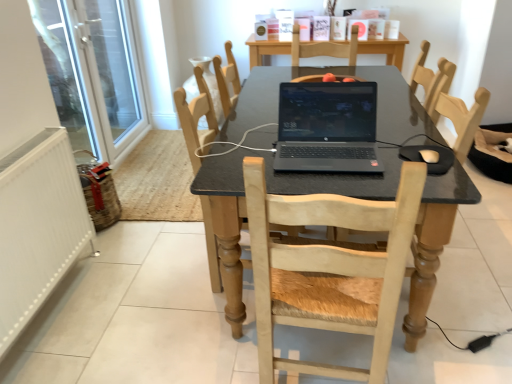
What do you see at coordinates (272, 193) in the screenshot? I see `matte black table at center` at bounding box center [272, 193].

What is the approximate height of light wood chair at center, which ranks as the 1th chair in front-to-back order?

light wood chair at center, which ranks as the 1th chair in front-to-back order, is 1.01 meters tall.

Find the location of a particular element. The image size is (512, 384). light wood chair at center, the 3th chair positioned from the back is located at coordinates (329, 269).

Where is `black matte laptop at center`? black matte laptop at center is located at coordinates (327, 127).

Where is `white textured radiator at left`? This screenshot has width=512, height=384. white textured radiator at left is located at coordinates (38, 227).

Where is `light wood chair at center, which is counted as the 2th chair, starting from the back`? The width and height of the screenshot is (512, 384). light wood chair at center, which is counted as the 2th chair, starting from the back is located at coordinates (196, 121).

This screenshot has height=384, width=512. I want to click on white matte mouse at lower right, so click(429, 155).

Describe the element at coordinates (210, 84) in the screenshot. I see `wooden chair at upper center, the 1th chair from the back` at that location.

Locate an element on the screen. The width and height of the screenshot is (512, 384). wooden chair at upper center, the 1th chair from the back is located at coordinates (210, 84).

You are a GUI agent. You are given a task and a screenshot of the screen. Output one action in this format:
    pyautogui.click(x=<x>, y=<y>)
    Task: Click on the matte black table at center
    This screenshot has height=384, width=512.
    Given the screenshot: What is the action you would take?
    pyautogui.click(x=272, y=193)

Is white matte mouse at lower right further to camera compared to matte black table at center?

That is True.

Does white matte mouse at lower right turn towards matte black table at center?

No, white matte mouse at lower right is not facing towards matte black table at center.

Considering the sizes of white matte mouse at lower right and matte black table at center in the image, is white matte mouse at lower right bigger or smaller than matte black table at center?

Clearly, white matte mouse at lower right is smaller in size than matte black table at center.

Between white matte mouse at lower right and matte black table at center, which one appears on the left side from the viewer's perspective?

From the viewer's perspective, matte black table at center appears more on the left side.

Does light wood chair at center, which ranks as the 1th chair in front-to-back order, contain white textured radiator at left?

No, white textured radiator at left is not a part of light wood chair at center, which ranks as the 1th chair in front-to-back order.

Is light wood chair at center, the 3th chair positioned from the back, to the left of white textured radiator at left from the viewer's perspective?

No.

Based on the photo, how different are the orientations of light wood chair at center, the 3th chair positioned from the back, and white textured radiator at left in degrees?

light wood chair at center, the 3th chair positioned from the back, and white textured radiator at left are facing 86.6 degrees away from each other.

Considering the relative sizes of light wood chair at center, the 3th chair positioned from the back, and white textured radiator at left in the image provided, is light wood chair at center, the 3th chair positioned from the back, wider than white textured radiator at left?

Correct, the width of light wood chair at center, the 3th chair positioned from the back, exceeds that of white textured radiator at left.

From a real-world perspective, between white matte mouse at lower right and white glass screen door at left, who is vertically lower?

white glass screen door at left is physically lower.

Based on the photo, what's the angular difference between white matte mouse at lower right and white glass screen door at left's facing directions?

The angular difference between white matte mouse at lower right and white glass screen door at left is 86.9 degrees.

Consider the image. Is white matte mouse at lower right wider or thinner than white glass screen door at left?

In the image, white matte mouse at lower right appears to be wider than white glass screen door at left.

Is white matte mouse at lower right aimed at white glass screen door at left?

No, white matte mouse at lower right does not turn towards white glass screen door at left.

Between light wood chair at center, the 3th chair positioned from the back, and white matte mouse at lower right, which one has less height?

white matte mouse at lower right is shorter.

Are light wood chair at center, the 3th chair positioned from the back, and white matte mouse at lower right making contact?

No, light wood chair at center, the 3th chair positioned from the back, is not making contact with white matte mouse at lower right.

Who is smaller, light wood chair at center, which ranks as the 1th chair in front-to-back order, or white matte mouse at lower right?

white matte mouse at lower right is smaller.

Is light wood chair at center, the 3th chair positioned from the back, inside or outside of white matte mouse at lower right?

light wood chair at center, the 3th chair positioned from the back, exists outside the volume of white matte mouse at lower right.

Which object is thinner, matte black table at center or black matte laptop at center?

Thinner between the two is black matte laptop at center.

Is point (301, 73) positioned in front of point (329, 86)?

No, it is not.

Is matte black table at center facing towards black matte laptop at center?

No, matte black table at center is not turned towards black matte laptop at center.

From the image's perspective, is matte black table at center on black matte laptop at center?

Actually, matte black table at center appears below black matte laptop at center in the image.

From the image's perspective, would you say white glass screen door at left is shown under light wood chair at center, which ranks as the 1th chair in front-to-back order?

No.

From a real-world perspective, is white glass screen door at left physically located above or below light wood chair at center, which ranks as the 1th chair in front-to-back order?

white glass screen door at left is above light wood chair at center, which ranks as the 1th chair in front-to-back order.

Is light wood chair at center, the 3th chair positioned from the back, a part of white glass screen door at left?

No, light wood chair at center, the 3th chair positioned from the back, is not surrounded by white glass screen door at left.

Can you confirm if white glass screen door at left is thinner than light wood chair at center, which ranks as the 1th chair in front-to-back order?

Indeed, white glass screen door at left has a lesser width compared to light wood chair at center, which ranks as the 1th chair in front-to-back order.

From a real-world perspective, who is located lower, light wood chair at center, which ranks as the second chair in front-to-back order, or matte black table at center?

From a 3D spatial view, matte black table at center is below.

How much distance is there between light wood chair at center, which is counted as the 2th chair, starting from the back, and matte black table at center?

They are 12.12 inches apart.

Is the position of light wood chair at center, which ranks as the second chair in front-to-back order, more distant than that of matte black table at center?

Yes, it is behind matte black table at center.

The width and height of the screenshot is (512, 384). Find the location of `desk below the white matte mouse at lower right (from a real-world perspective)`. desk below the white matte mouse at lower right (from a real-world perspective) is located at coordinates (272, 193).

The width and height of the screenshot is (512, 384). Find the location of `radiator located above the light wood chair at center, which ranks as the 1th chair in front-to-back order (from the image's perspective)`. radiator located above the light wood chair at center, which ranks as the 1th chair in front-to-back order (from the image's perspective) is located at coordinates coord(38,227).

In the scene shown: Looking at the image, which one is located closer to matte black table at center, black matte laptop at center or light wood chair at center, which ranks as the second chair in front-to-back order?

The object closer to matte black table at center is black matte laptop at center.

From the image, which object appears to be nearer to wooden chair at upper center, arranged as the third chair when viewed from the front, white glass screen door at left or light wood chair at center, which ranks as the second chair in front-to-back order?

Based on the image, light wood chair at center, which ranks as the second chair in front-to-back order, appears to be nearer to wooden chair at upper center, arranged as the third chair when viewed from the front.

From the image, which object appears to be nearer to white matte mouse at lower right, white glass screen door at left or light wood chair at center, which ranks as the second chair in front-to-back order?

light wood chair at center, which ranks as the second chair in front-to-back order, lies closer to white matte mouse at lower right than the other object.

Looking at the image, which one is located closer to wooden chair at upper center, arranged as the third chair when viewed from the front, light wood chair at center, which ranks as the 1th chair in front-to-back order, or light wood chair at center, which is counted as the 2th chair, starting from the back?

light wood chair at center, which is counted as the 2th chair, starting from the back, is positioned closer to the anchor wooden chair at upper center, arranged as the third chair when viewed from the front.

Looking at the image, which one is located further to white matte mouse at lower right, white textured radiator at left or light wood chair at center, which ranks as the second chair in front-to-back order?

Based on the image, white textured radiator at left appears to be further to white matte mouse at lower right.

Looking at the image, which one is located closer to light wood chair at center, which ranks as the 1th chair in front-to-back order, light wood chair at center, which is counted as the 2th chair, starting from the back, or white glass screen door at left?

light wood chair at center, which is counted as the 2th chair, starting from the back, lies closer to light wood chair at center, which ranks as the 1th chair in front-to-back order, than the other object.

Which object lies further to the anchor point light wood chair at center, which is counted as the 2th chair, starting from the back, matte black table at center or wooden chair at upper center, arranged as the third chair when viewed from the front?

matte black table at center is positioned further to the anchor light wood chair at center, which is counted as the 2th chair, starting from the back.

Estimate the real-world distances between objects in this image. Which object is further from light wood chair at center, which is counted as the 2th chair, starting from the back, white glass screen door at left or white matte mouse at lower right?

The object further to light wood chair at center, which is counted as the 2th chair, starting from the back, is white glass screen door at left.

You are a GUI agent. You are given a task and a screenshot of the screen. Output one action in this format:
    pyautogui.click(x=<x>, y=<y>)
    Task: Click on the desk between light wood chair at center, the 3th chair positioned from the back, and white matte mouse at lower right in the front-back direction
    This screenshot has height=384, width=512.
    Given the screenshot: What is the action you would take?
    pyautogui.click(x=272, y=193)

Identify the location of chair between black matte laptop at center and wooden chair at upper center, arranged as the third chair when viewed from the front, along the z-axis. Image resolution: width=512 pixels, height=384 pixels. (196, 121).

Locate an element on the screen. The image size is (512, 384). laptop situated between white textured radiator at left and white matte mouse at lower right from left to right is located at coordinates (327, 127).

The width and height of the screenshot is (512, 384). Identify the location of chair between white textured radiator at left and wooden chair at upper center, the 1th chair from the back, in the front-back direction. pyautogui.click(x=196, y=121).